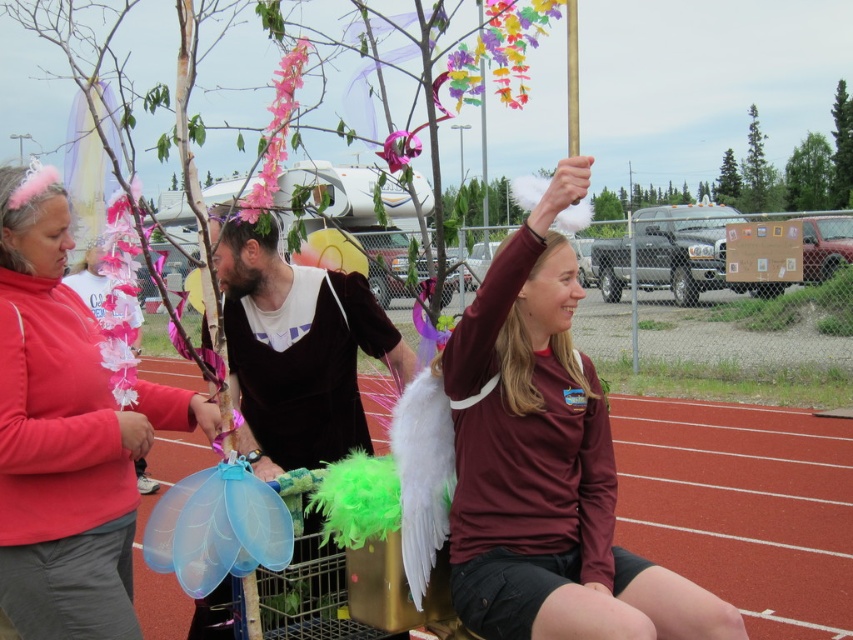
What is the color of the scarf worn by the person at the point marked as (65, 435)?

The person at the point marked as (65, 435) is wearing a matte pink scarf.

You are a photographer at the event and want to capture a photo where both the maroon jersey at center and the matte pink scarf at left are visible. Considering their heights, which object should be placed closer to the camera to ensure both are fully visible?

The maroon jersey at center is shorter than the matte pink scarf at left. To ensure both are fully visible, the shorter maroon jersey at center should be placed closer to the camera so that the taller matte pink scarf at left can be captured without being cut off.

You are standing at the center of the image and want to find the matte pink scarf at left. In which direction should you look to locate it?

You should look to the left to locate the matte pink scarf at left since it is positioned at the left side of the image.